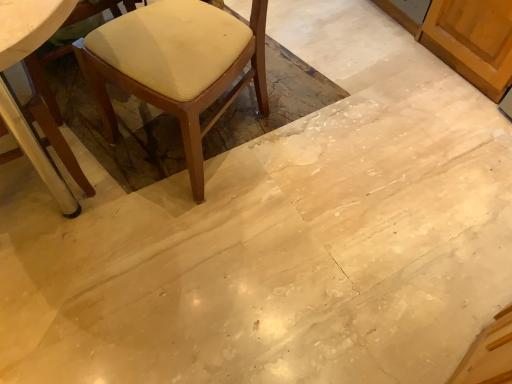
Locate an element on the screen. Image resolution: width=512 pixels, height=384 pixels. vacant point to the right of wooden chair at left, which is the 2th chair in right-to-left order is located at coordinates (127, 206).